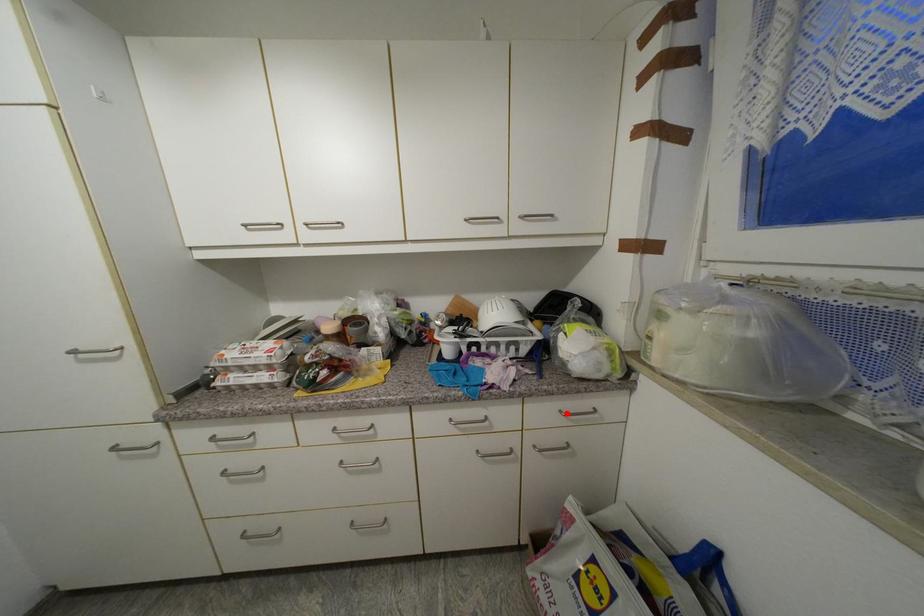
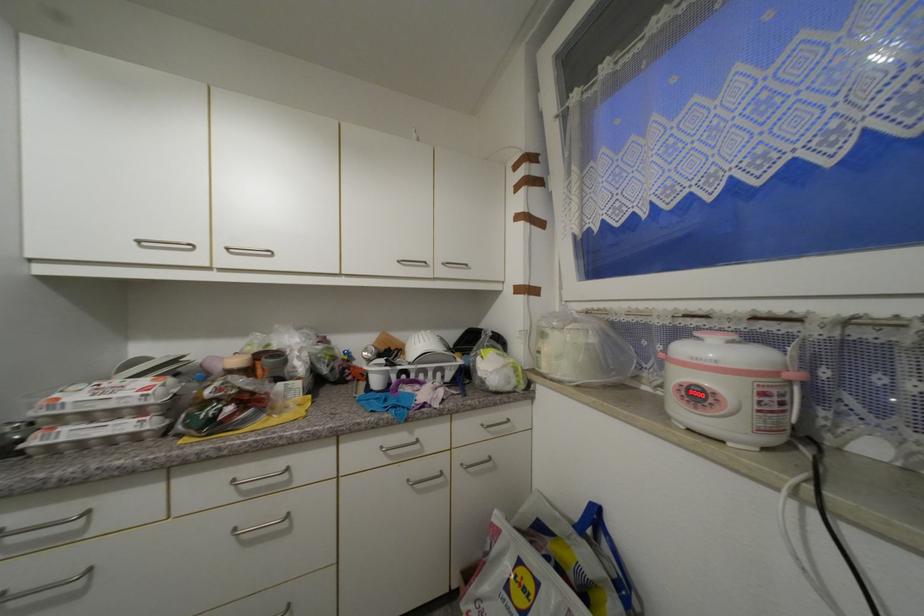
Locate, in the second image, the point that corresponds to the highlighted location in the first image.

(488, 427)